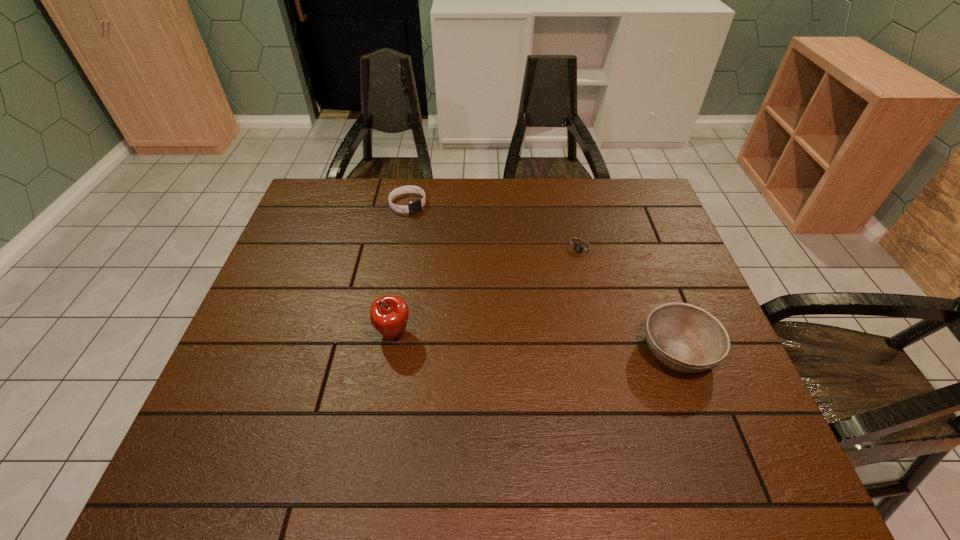
Locate an element on the screen. The image size is (960, 540). free space between the shortest object and the rightmost object is located at coordinates (630, 299).

I want to click on free space that is in between the second object from right to left and the bowl, so click(x=630, y=299).

Locate which object is the closest to the apple. Please provide its 2D coordinates. Your answer should be formatted as a tuple, i.e. [(x, y)], where the tuple contains the x and y coordinates of a point satisfying the conditions above.

[(415, 206)]

At what (x,y) coordinates should I click in order to perform the action: click on object that is the second closest one to the bowl. Please return your answer as a coordinate pair (x, y). Looking at the image, I should click on [389, 314].

Find the location of a particular element. The image size is (960, 540). vacant space that satisfies the following two spatial constraints: 1. on the front side of the wristband; 2. on the right side of the apple is located at coordinates (384, 335).

You are a GUI agent. You are given a task and a screenshot of the screen. Output one action in this format:
    pyautogui.click(x=<x>, y=<y>)
    Task: Click on the free spot that satisfies the following two spatial constraints: 1. on the front side of the third object from left to right; 2. on the right side of the wristband
    The height and width of the screenshot is (540, 960).
    Given the screenshot: What is the action you would take?
    pyautogui.click(x=399, y=248)